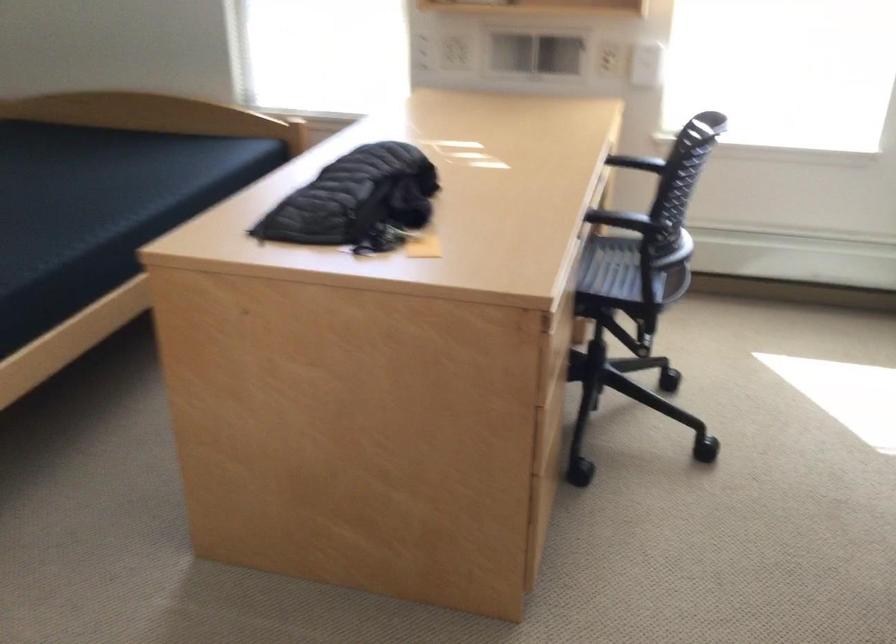
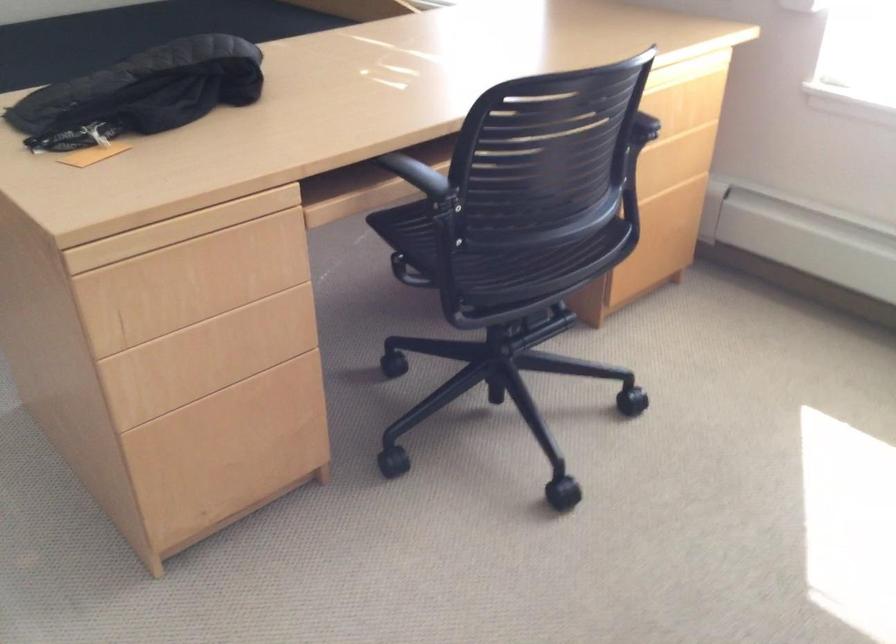
Where in the second image is the point corresponding to [550,283] from the first image?

(179, 229)